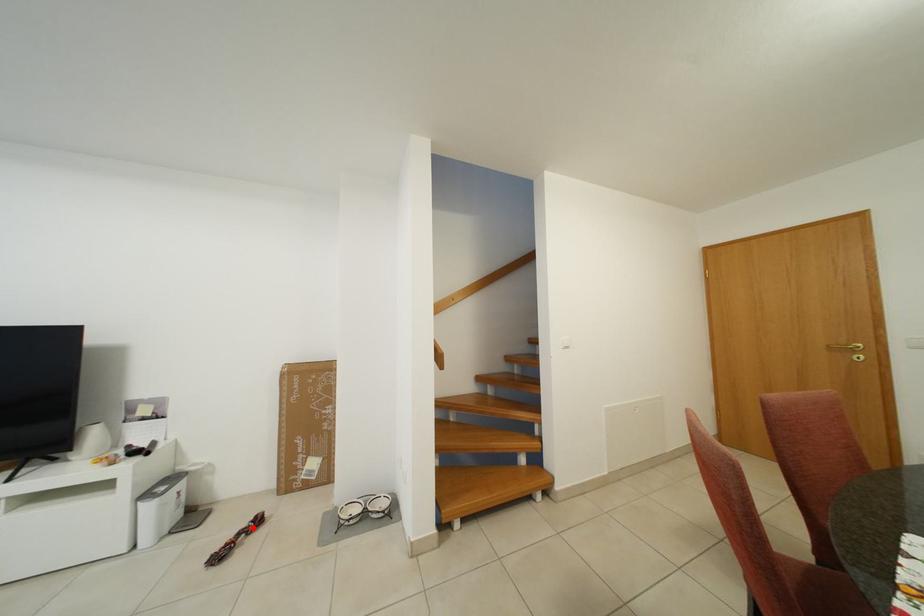
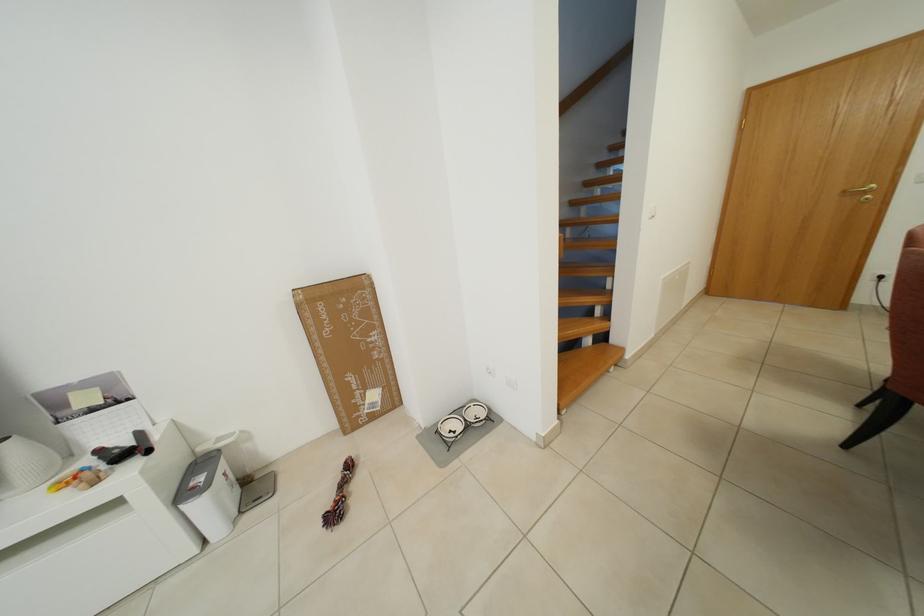
Find the pixel in the second image that matches the highlighted location in the first image.

(346, 479)